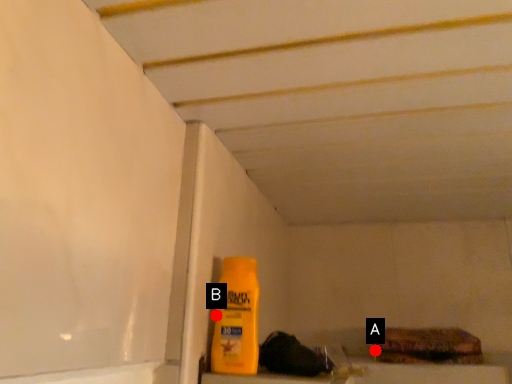
Question: Two points are circled on the image, labeled by A and B beside each circle. Which point is farther from the camera taking this photo?

Choices:
 (A) A is further
 (B) B is further

Answer: (A)